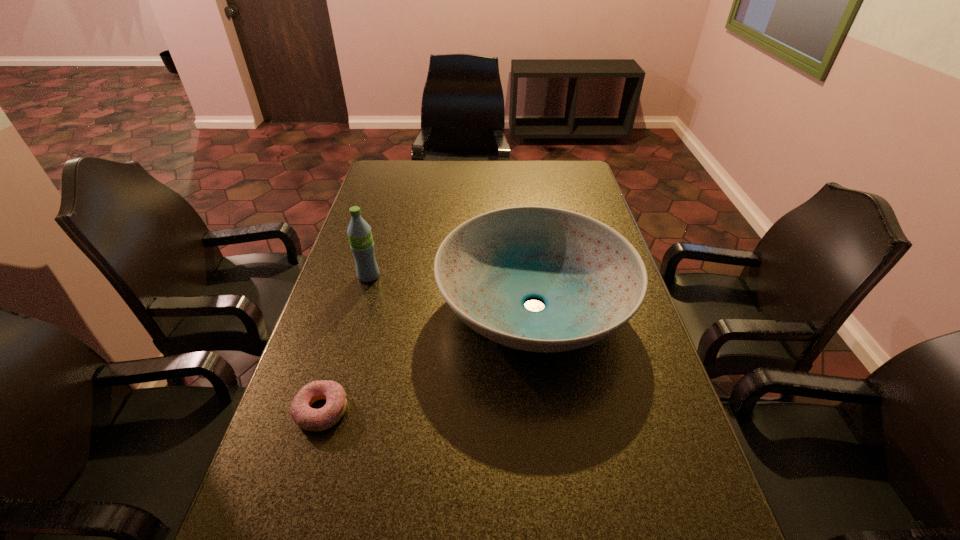
The image size is (960, 540). Find the location of `vacant space that satisfies the following two spatial constraints: 1. on the back side of the nearest object; 2. on the right side of the tallest object`. vacant space that satisfies the following two spatial constraints: 1. on the back side of the nearest object; 2. on the right side of the tallest object is located at coordinates (363, 276).

Find the location of a particular element. free region that satisfies the following two spatial constraints: 1. on the front side of the water bottle; 2. on the right side of the dish is located at coordinates (360, 306).

The height and width of the screenshot is (540, 960). In order to click on free spot that satisfies the following two spatial constraints: 1. on the back side of the doughnut; 2. on the left side of the second tallest object in this screenshot , I will do `click(353, 306)`.